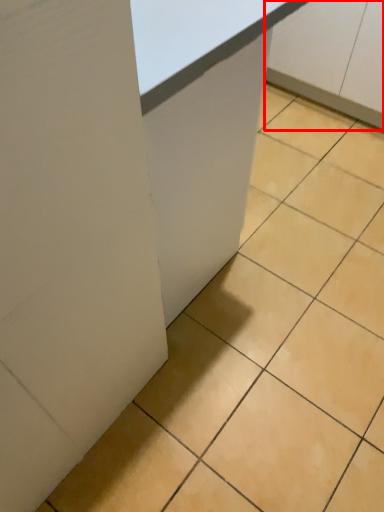
Question: From the image's perspective, where is cabinetry (annotated by the red box) located in relation to table in the image?

Choices:
 (A) above
 (B) below

Answer: (A)